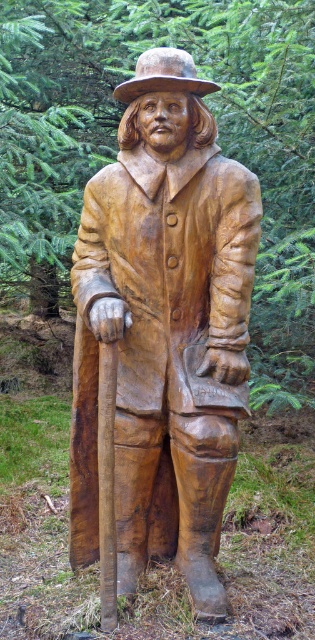
Question: Considering the relative positions of wooden statue at center and wooden textured hat at center in the image provided, where is wooden statue at center located with respect to wooden textured hat at center?

Choices:
 (A) left
 (B) right

Answer: (A)

Question: Does wooden statue at center have a greater width compared to wooden textured hat at center?

Choices:
 (A) no
 (B) yes

Answer: (B)

Question: Among these points, which one is nearest to the camera?

Choices:
 (A) (137, 301)
 (B) (177, 88)

Answer: (B)

Question: Which point is farther to the camera?

Choices:
 (A) wooden statue at center
 (B) wooden textured hat at center

Answer: (B)

Question: Which point is farther to the camera?

Choices:
 (A) 118,90
 (B) 232,452

Answer: (B)

Question: Can you confirm if wooden statue at center is thinner than wooden textured hat at center?

Choices:
 (A) no
 (B) yes

Answer: (A)